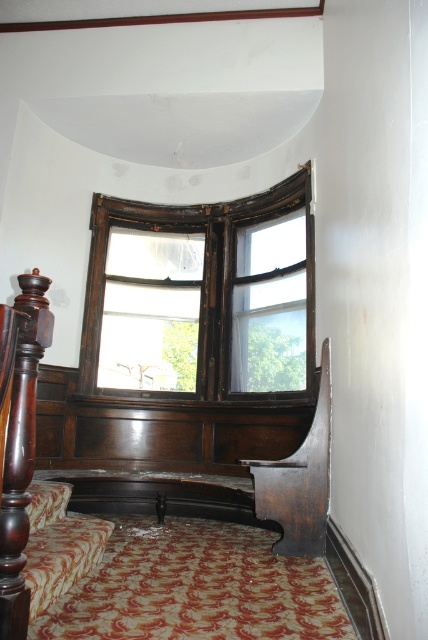
Between wooden frame window at upper center and dark wood/rustic stair rail at lower left, which one has more height?

wooden frame window at upper center is taller.

At what (x,y) coordinates should I click in order to perform the action: click on wooden frame window at upper center. Please return your answer as a coordinate pair (x, y). Image resolution: width=428 pixels, height=640 pixels. Looking at the image, I should click on (208, 291).

Who is more distant from viewer, (249, 205) or (12, 472)?

Point (249, 205)

Locate an element on the screen. Image resolution: width=428 pixels, height=640 pixels. wooden frame window at upper center is located at coordinates (208, 291).

Does dark wood bed at center lie in front of dark wood/rustic stair rail at lower left?

No, it is not.

Between dark wood bed at center and dark wood/rustic stair rail at lower left, which one has less height?

Standing shorter between the two is dark wood bed at center.

Find the location of a particular element. This screenshot has width=428, height=640. dark wood bed at center is located at coordinates (35, 390).

Between wooden frame window at upper center and dark wood bed at center, which one appears on the left side from the viewer's perspective?

Positioned to the left is dark wood bed at center.

Between point (168, 205) and point (240, 464), which one is positioned in front?

Point (240, 464) is more forward.

Describe the element at coordinates (208, 291) in the screenshot. I see `wooden frame window at upper center` at that location.

At what (x,y) coordinates should I click in order to perform the action: click on wooden frame window at upper center. Please return your answer as a coordinate pair (x, y). Image resolution: width=428 pixels, height=640 pixels. Looking at the image, I should click on (208, 291).